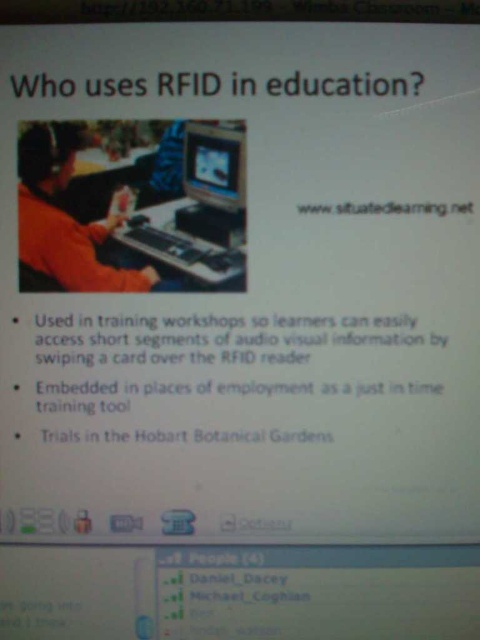
You are a student trying to focus on the presentation slide. The orange fabric shirt at left is blocking your view of the matte black monitor at center. Can you see the slide clearly?

The orange fabric shirt at left is in front of the matte black monitor at center, so it is blocking your view of the slide. You cannot see the slide clearly.

In the image, there is a point at coordinates (68, 214). What object is located at that point?

The point at coordinates (68, 214) indicates the orange fabric shirt at left.